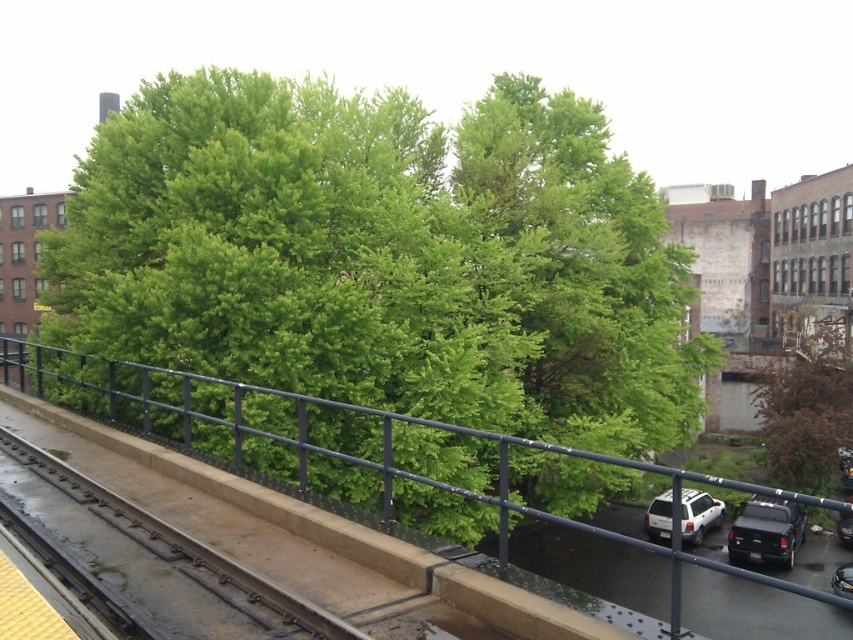
You are standing on a platform and want to take a photo of both the brown textured tree at lower right and the smooth concrete train track at lower left. Which object should you focus on first if you want to ensure both are fully in frame without moving the camera?

You should focus on the brown textured tree at lower right first because it is taller than the smooth concrete train track at lower left, so adjusting the camera angle to include its full height will naturally include the shorter track in the frame as well.